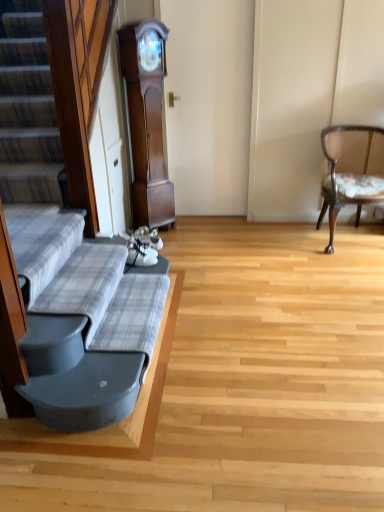
Question: Based on their sizes in the image, would you say dark wood grandfather clock at center is bigger or smaller than wooden upholstered chair at right?

Choices:
 (A) big
 (B) small

Answer: (B)

Question: In terms of height, does dark wood grandfather clock at center look taller or shorter compared to wooden upholstered chair at right?

Choices:
 (A) short
 (B) tall

Answer: (B)

Question: Which object is positioned farthest from the dark wood grandfather clock at center?

Choices:
 (A) plaid fabric couch at left
 (B) wooden upholstered chair at right

Answer: (A)

Question: Which object is positioned farthest from the plaid fabric couch at left?

Choices:
 (A) wooden upholstered chair at right
 (B) dark wood grandfather clock at center

Answer: (A)